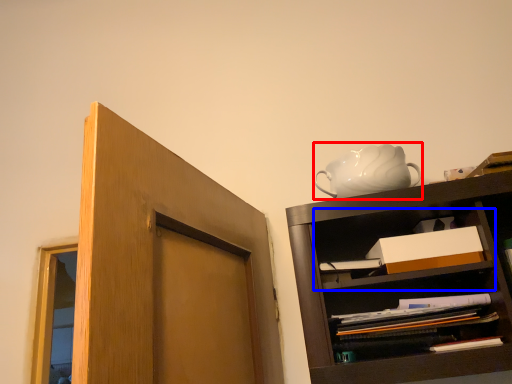
Question: Which of the following is the closest to the observer, tea pot (highlighted by a red box) or cabinet (highlighted by a blue box)?

Choices:
 (A) tea pot
 (B) cabinet

Answer: (B)